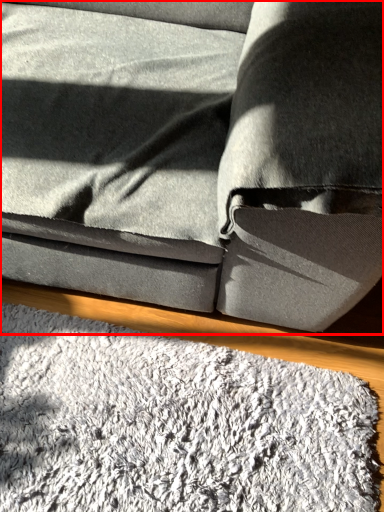
Question: Observing the image, what is the correct spatial positioning of studio couch (annotated by the red box) in reference to mat?

Choices:
 (A) left
 (B) right

Answer: (A)